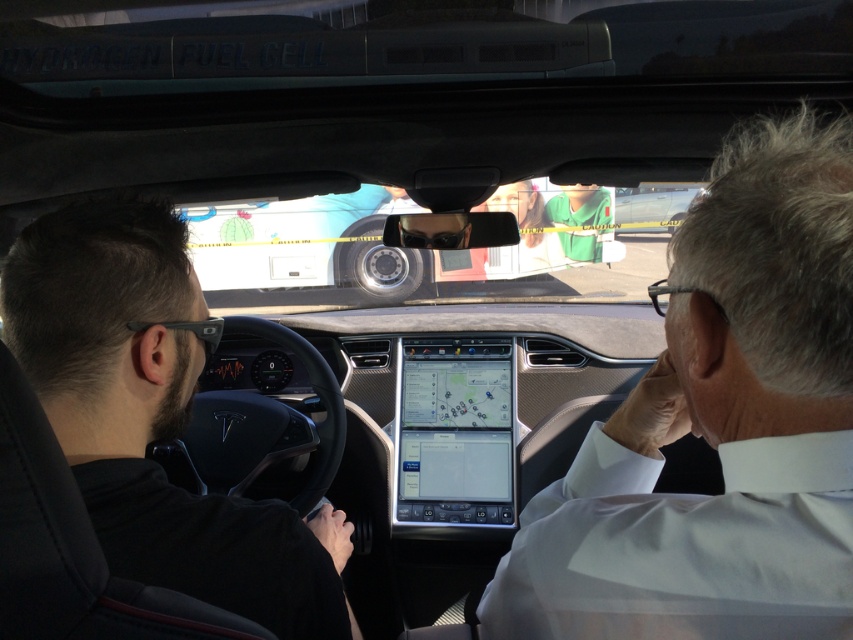
Question: Which point is farther to the camera?

Choices:
 (A) (780, 467)
 (B) (164, 429)

Answer: (B)

Question: Does white shirt at center appear over black matte jacket at left?

Choices:
 (A) yes
 (B) no

Answer: (A)

Question: Which point is farther to the camera?

Choices:
 (A) white shirt at center
 (B) black matte jacket at left

Answer: (B)

Question: From the image, what is the correct spatial relationship of white shirt at center in relation to black matte jacket at left?

Choices:
 (A) right
 (B) left

Answer: (A)

Question: Observing the image, what is the correct spatial positioning of white shirt at center in reference to black matte jacket at left?

Choices:
 (A) below
 (B) above

Answer: (B)